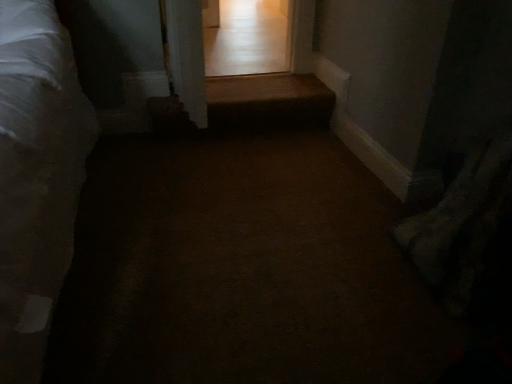
This screenshot has height=384, width=512. Describe the element at coordinates (241, 268) in the screenshot. I see `brown carpet at center` at that location.

Image resolution: width=512 pixels, height=384 pixels. Identify the location of brown carpet at center. (241, 268).

The height and width of the screenshot is (384, 512). What are the coordinates of `brown carpet at center` in the screenshot? It's located at (241, 268).